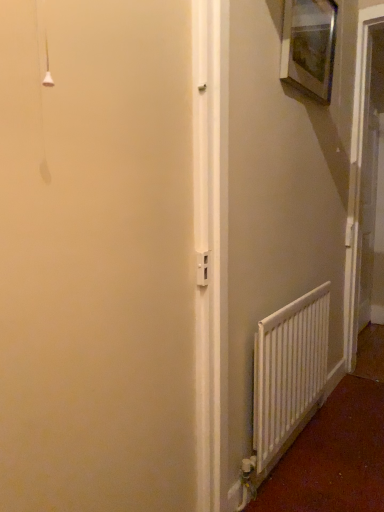
Question: From a real-world perspective, does white plastic screen door at right sit lower than wooden picture frame at upper right?

Choices:
 (A) no
 (B) yes

Answer: (B)

Question: Is wooden picture frame at upper right completely or partially inside white plastic screen door at right?

Choices:
 (A) yes
 (B) no

Answer: (B)

Question: Considering the relative sizes of white plastic screen door at right and wooden picture frame at upper right in the image provided, is white plastic screen door at right smaller than wooden picture frame at upper right?

Choices:
 (A) no
 (B) yes

Answer: (A)

Question: Can you confirm if white plastic screen door at right is positioned to the right of wooden picture frame at upper right?

Choices:
 (A) yes
 (B) no

Answer: (A)

Question: Can you confirm if white plastic screen door at right is bigger than wooden picture frame at upper right?

Choices:
 (A) yes
 (B) no

Answer: (A)

Question: Is wooden picture frame at upper right inside or outside of white plastic screen door at right?

Choices:
 (A) outside
 (B) inside

Answer: (A)

Question: In the image, is wooden picture frame at upper right positioned in front of or behind white plastic screen door at right?

Choices:
 (A) behind
 (B) front

Answer: (B)

Question: Based on their positions, is wooden picture frame at upper right located to the left or right of white plastic screen door at right?

Choices:
 (A) left
 (B) right

Answer: (A)

Question: Considering the positions of wooden picture frame at upper right and white plastic screen door at right in the image, is wooden picture frame at upper right wider or thinner than white plastic screen door at right?

Choices:
 (A) thin
 (B) wide

Answer: (A)

Question: Is white matte radiator at lower right wider or thinner than white plastic screen door at right?

Choices:
 (A) wide
 (B) thin

Answer: (B)

Question: Do you think white matte radiator at lower right is within white plastic screen door at right, or outside of it?

Choices:
 (A) inside
 (B) outside

Answer: (B)

Question: Visually, is white matte radiator at lower right positioned to the left or to the right of white plastic screen door at right?

Choices:
 (A) right
 (B) left

Answer: (B)

Question: Based on their sizes in the image, would you say white matte radiator at lower right is bigger or smaller than white plastic screen door at right?

Choices:
 (A) small
 (B) big

Answer: (A)

Question: Considering the positions of white plastic screen door at right and white matte radiator at lower right in the image, is white plastic screen door at right wider or thinner than white matte radiator at lower right?

Choices:
 (A) wide
 (B) thin

Answer: (A)

Question: Looking at the image, does white plastic screen door at right seem bigger or smaller compared to white matte radiator at lower right?

Choices:
 (A) big
 (B) small

Answer: (A)